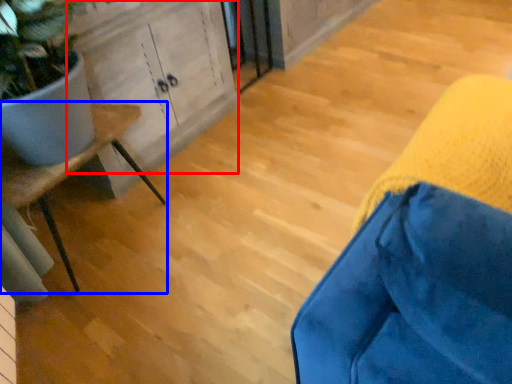
Question: Which object is closer to the camera taking this photo, cabinetry (highlighted by a red box) or furniture (highlighted by a blue box)?

Choices:
 (A) cabinetry
 (B) furniture

Answer: (B)